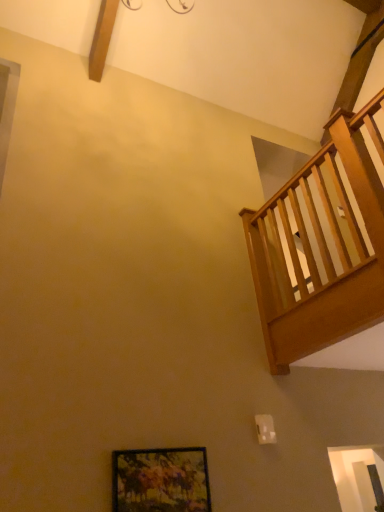
Question: Is wooden-framed painting at lower center inside the boundaries of wooden railing at upper right, or outside?

Choices:
 (A) outside
 (B) inside

Answer: (A)

Question: Is wooden-framed painting at lower center taller or shorter than wooden railing at upper right?

Choices:
 (A) tall
 (B) short

Answer: (B)

Question: In terms of width, does wooden-framed painting at lower center look wider or thinner when compared to wooden railing at upper right?

Choices:
 (A) wide
 (B) thin

Answer: (B)

Question: Is wooden railing at upper right to the left or to the right of wooden-framed painting at lower center in the image?

Choices:
 (A) left
 (B) right

Answer: (B)

Question: From their relative heights in the image, would you say wooden railing at upper right is taller or shorter than wooden-framed painting at lower center?

Choices:
 (A) short
 (B) tall

Answer: (B)

Question: From a real-world perspective, relative to wooden-framed painting at lower center, is wooden railing at upper right vertically above or below?

Choices:
 (A) below
 (B) above

Answer: (B)

Question: Is wooden railing at upper right inside the boundaries of wooden-framed painting at lower center, or outside?

Choices:
 (A) outside
 (B) inside

Answer: (A)